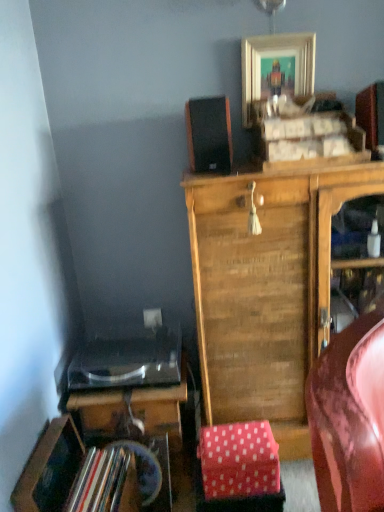
Where is `free spot above pink polka dot fabric at lower center (from a real-world perspective)`? This screenshot has width=384, height=512. free spot above pink polka dot fabric at lower center (from a real-world perspective) is located at coordinates (237, 438).